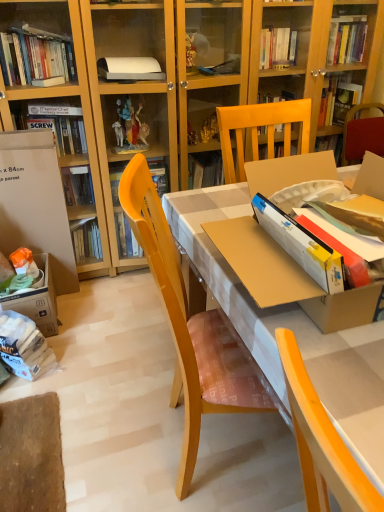
Question: Is white cardboard box at left in front of or behind matte yellow desk at center in the image?

Choices:
 (A) front
 (B) behind

Answer: (B)

Question: From a real-world perspective, is white cardboard box at left above or below matte yellow desk at center?

Choices:
 (A) below
 (B) above

Answer: (A)

Question: Which object is the closest to the matte yellow desk at center?

Choices:
 (A) white paper bag at lower left
 (B) white cardboard box at left

Answer: (B)

Question: Based on their relative distances, which object is farther from the matte yellow desk at center?

Choices:
 (A) white cardboard box at left
 (B) white paper bag at lower left

Answer: (B)